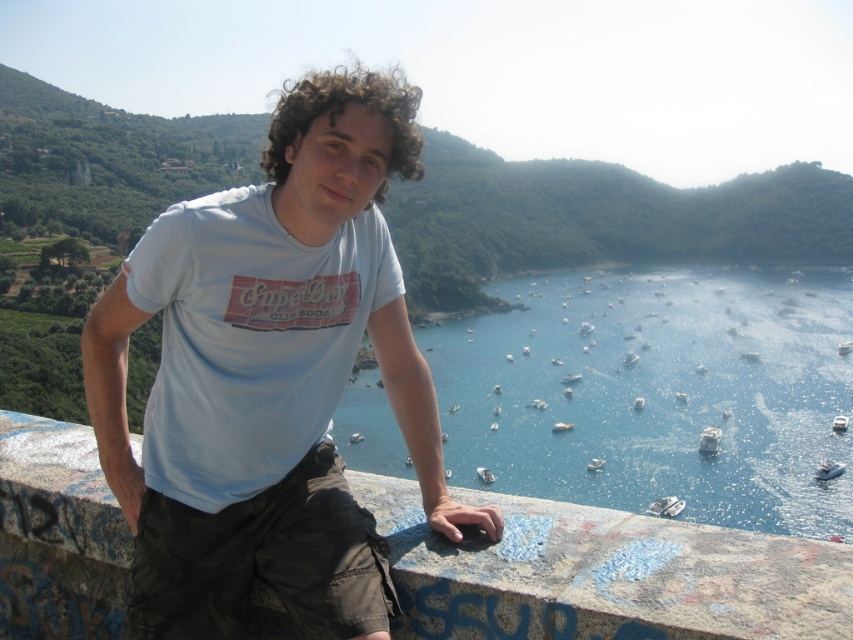
You are a drone operator trying to capture the best aerial shot of the coastal scene. You have two points marked on your map, point 1 at coordinates point (352, 500) and point 2 at coordinates point (677, 502). Which point should you choose to get a closer perspective for your drone camera?

Point (352, 500) is closer to the viewer than point (677, 502), so you should choose point (352, 500) to get a closer perspective for your drone camera.

You are planning to jump from the granite ledge at center into the blue water at center. Considering the width of the ledge and the water, is there enough space for you to safely land in the water?

The blue water at center might be wider than granite ledge at center, so there is a possibility that the water is wide enough to safely land in, but the exact width difference is uncertain. Proceed with caution.

You are a photographer trying to capture the entire scene in one shot. Given that your camera can only focus on one object at a time, which object between the blue water at center and the granite ledge at center should you choose to ensure the larger object is in focus?

The blue water at center is bigger than the granite ledge at center, so you should focus on the blue water at center to ensure the larger object is in focus.